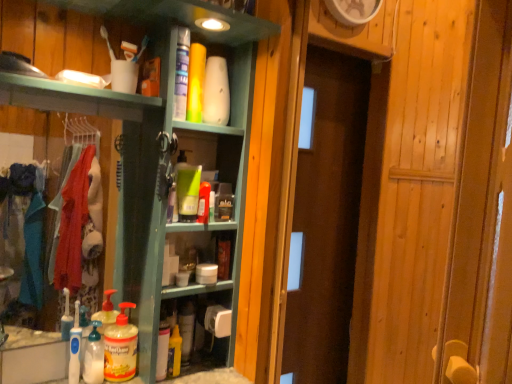
Question: Considering the relative sizes of yellow matte bottle at lower center, the second cleaning product positioned from the right, and wooden door at center in the image provided, is yellow matte bottle at lower center, the second cleaning product positioned from the right, thinner than wooden door at center?

Choices:
 (A) yes
 (B) no

Answer: (B)

Question: Is yellow matte bottle at lower center, the second cleaning product positioned from the right, not close to wooden door at center?

Choices:
 (A) no
 (B) yes

Answer: (A)

Question: Is yellow matte bottle at lower center, which ranks as the 6th cleaning product in left-to-right order, looking in the opposite direction of wooden door at center?

Choices:
 (A) yes
 (B) no

Answer: (B)

Question: From a real-world perspective, is yellow matte bottle at lower center, the second cleaning product positioned from the right, on top of wooden door at center?

Choices:
 (A) no
 (B) yes

Answer: (A)

Question: From the image's perspective, does yellow matte bottle at lower center, the second cleaning product positioned from the right, appear higher than wooden door at center?

Choices:
 (A) no
 (B) yes

Answer: (A)

Question: Is yellow matte bottle at lower center, the third cleaning product positioned from the right, in front of or behind white matte toilet paper at lower center in the image?

Choices:
 (A) front
 (B) behind

Answer: (A)

Question: From the image's perspective, is yellow matte bottle at lower center, placed as the 5th cleaning product when sorted from left to right, located above or below white matte toilet paper at lower center?

Choices:
 (A) above
 (B) below

Answer: (B)

Question: In the image, is yellow matte bottle at lower center, placed as the 5th cleaning product when sorted from left to right, on the left side or the right side of white matte toilet paper at lower center?

Choices:
 (A) left
 (B) right

Answer: (A)

Question: In terms of size, does yellow matte bottle at lower center, the third cleaning product positioned from the right, appear bigger or smaller than white matte toilet paper at lower center?

Choices:
 (A) big
 (B) small

Answer: (B)

Question: Is point (17, 302) closer or farther from the camera than point (95, 362)?

Choices:
 (A) farther
 (B) closer

Answer: (A)

Question: From the image's perspective, is white fabric laundry at left positioned above or below translucent plastic bottle at lower left, arranged as the 6th cleaning product when viewed from the right?

Choices:
 (A) below
 (B) above

Answer: (B)

Question: Choose the correct answer: Is white fabric laundry at left inside translucent plastic bottle at lower left, which ranks as the second cleaning product in left-to-right order, or outside it?

Choices:
 (A) outside
 (B) inside

Answer: (A)

Question: Looking at their shapes, would you say white fabric laundry at left is wider or thinner than translucent plastic bottle at lower left, arranged as the 6th cleaning product when viewed from the right?

Choices:
 (A) wide
 (B) thin

Answer: (B)

Question: Is point (101, 352) closer or farther from the camera than point (193, 307)?

Choices:
 (A) closer
 (B) farther

Answer: (A)

Question: Is translucent plastic bottle at lower left, which ranks as the second cleaning product in left-to-right order, in front of or behind yellow matte bottle at lower center, which ranks as the 6th cleaning product in left-to-right order, in the image?

Choices:
 (A) front
 (B) behind

Answer: (A)